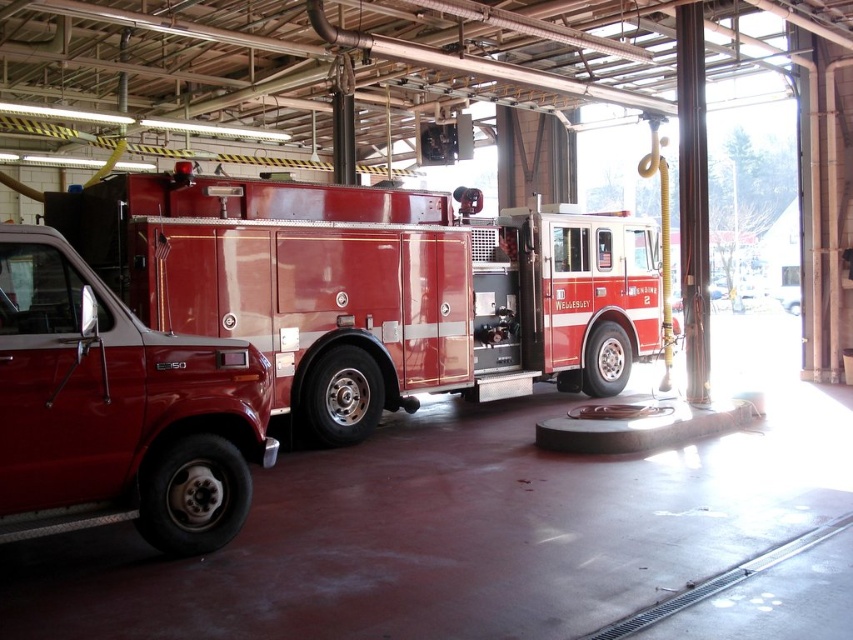
Can you confirm if shiny silver tire at center is shorter than rubber/smooth tire at center?

No.

Is shiny silver tire at center closer to camera compared to rubber/smooth tire at center?

Yes, it is.

Find the location of a particular element. Image resolution: width=853 pixels, height=640 pixels. shiny silver tire at center is located at coordinates (341, 396).

Who is more forward, (149, 188) or (209, 467)?

Positioned in front is point (209, 467).

What do you see at coordinates (369, 276) in the screenshot?
I see `shiny red fire truck at center` at bounding box center [369, 276].

Who is more distant from viewer, (314, 264) or (248, 502)?

The point (314, 264) is more distant.

This screenshot has width=853, height=640. What are the coordinates of `shiny red fire truck at center` in the screenshot? It's located at (369, 276).

Is point (160, 490) closer to camera compared to point (593, 369)?

That is True.

Between point (219, 476) and point (590, 362), which one is positioned in front?

Point (219, 476)

Who is more distant from viewer, [241,524] or [601,321]?

The point [601,321] is behind.

Find the location of a particular element. This screenshot has width=853, height=640. black rubber tire at lower left is located at coordinates (193, 496).